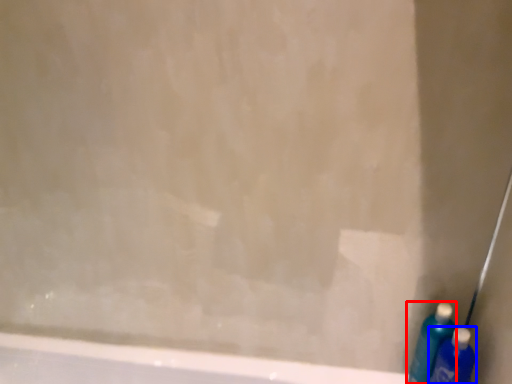
Question: Which of the following is the closest to the observer, cleaning product (highlighted by a red box) or cleaning product (highlighted by a blue box)?

Choices:
 (A) cleaning product
 (B) cleaning product

Answer: (B)